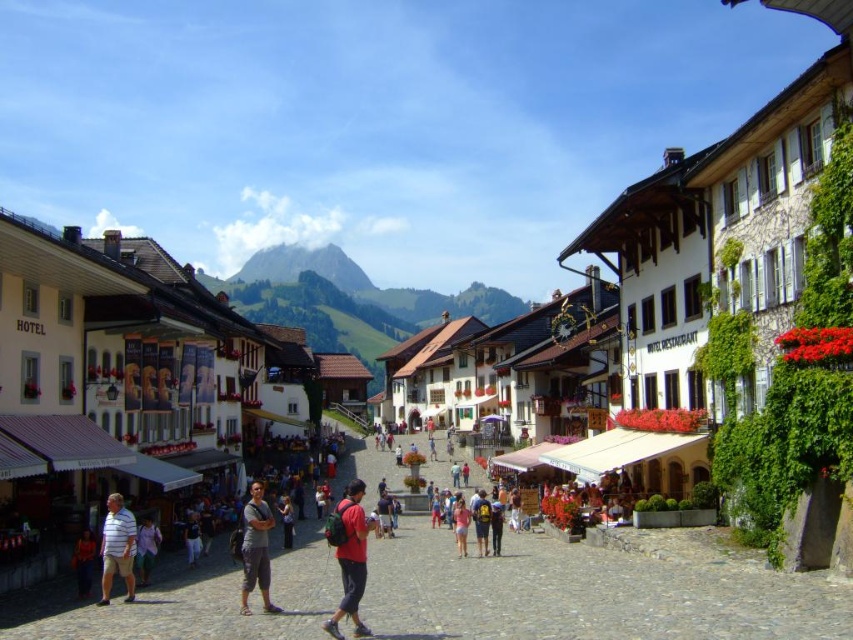
You are a traveler standing on the cobblestone street in the village. You notice two clothing items at the center of the scene. Which clothing item is positioned higher up, the gray cotton pants at center or the pink fabric shorts at center?

The gray cotton pants at center is located above the pink fabric shorts at center, so the gray cotton pants at center is positioned higher up.

You are a hiker who wants to choose a backpack with more storage space. You see a matte red backpack at center and a dark blue backpack at center. Which backpack should you choose based on their sizes?

The matte red backpack at center has a greater height compared to dark blue backpack at center, so you should choose the matte red backpack at center since it likely has more storage space.